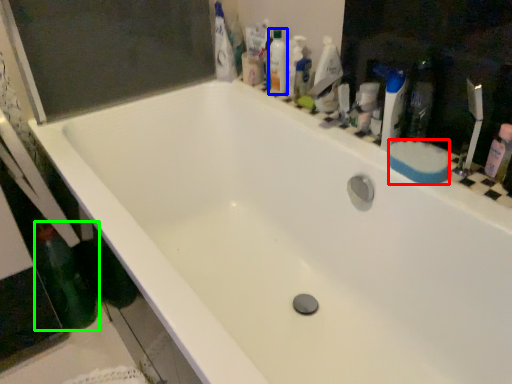
Question: Based on their relative distances, which object is farther from soap (highlighted by a red box)? Choose from mouthwash (highlighted by a blue box) and bottle (highlighted by a green box).

Choices:
 (A) mouthwash
 (B) bottle

Answer: (B)